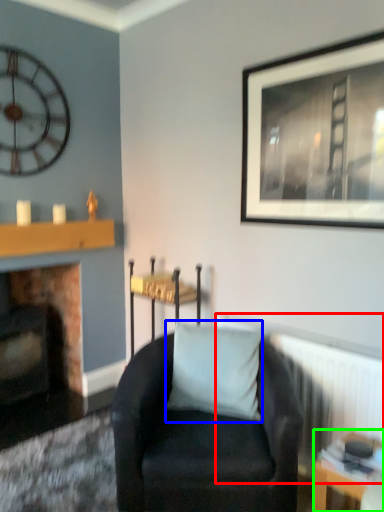
Question: Which is farther away from radiator (highlighted by a red box)? pillow (highlighted by a blue box) or table (highlighted by a green box)?

Choices:
 (A) pillow
 (B) table

Answer: (A)